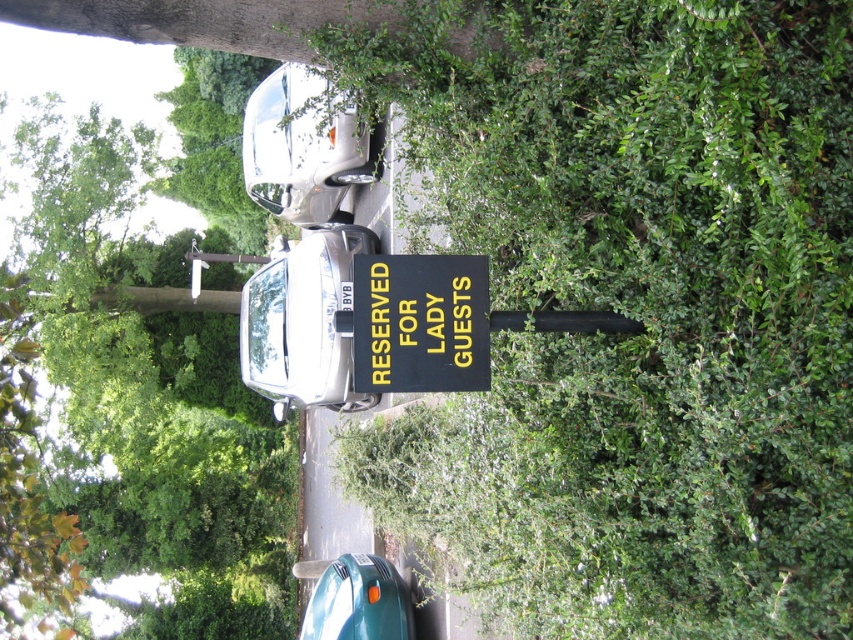
The height and width of the screenshot is (640, 853). Describe the element at coordinates (305, 323) in the screenshot. I see `satin silver car at center` at that location.

From the picture: Can you confirm if satin silver car at center is bigger than teal matte car at lower center?

Correct, satin silver car at center is larger in size than teal matte car at lower center.

Is point (316, 230) positioned after point (318, 604)?

Yes.

I want to click on satin silver car at center, so click(x=305, y=323).

Is silver metallic car at upper center bigger than teal matte car at lower center?

Incorrect, silver metallic car at upper center is not larger than teal matte car at lower center.

Who is lower down, silver metallic car at upper center or teal matte car at lower center?

teal matte car at lower center is below.

Is point (285, 120) positioned after point (372, 582)?

No, it is not.

Where is `silver metallic car at upper center`? silver metallic car at upper center is located at coordinates (302, 147).

Between black/yellow plastic sign at center and teal matte car at lower center, which one appears on the right side from the viewer's perspective?

black/yellow plastic sign at center is more to the right.

At what (x,y) coordinates should I click in order to perform the action: click on black/yellow plastic sign at center. Please return your answer as a coordinate pair (x, y). Image resolution: width=853 pixels, height=640 pixels. Looking at the image, I should click on (421, 323).